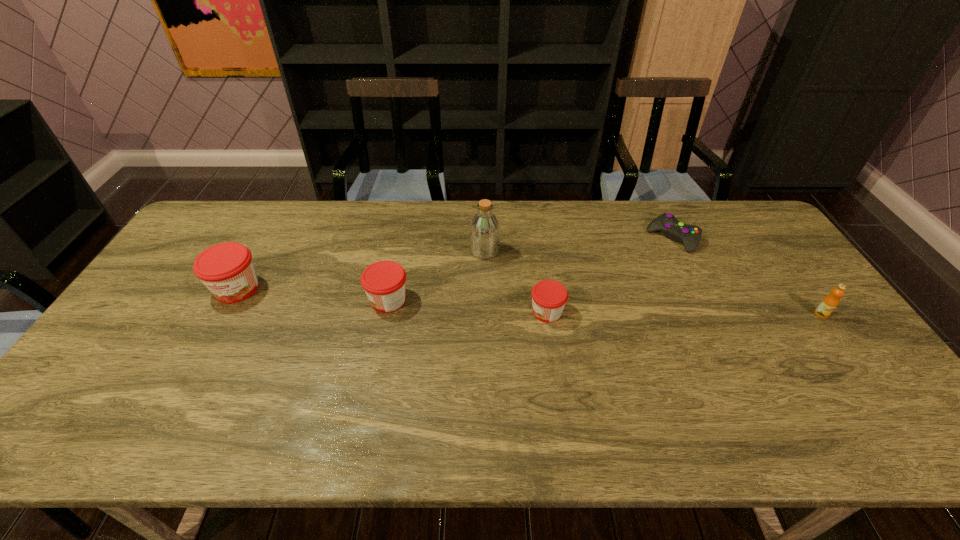
Identify the location of the leftmost jam. (227, 270).

The image size is (960, 540). In order to click on the tallest jam in this screenshot , I will do `click(227, 270)`.

Identify the location of the second jam from right to left. (384, 282).

Identify the location of the second tallest jam. This screenshot has height=540, width=960. (384, 282).

Identify the location of the third object from right to left. (549, 297).

Find the location of a particular element. the rightmost jam is located at coordinates (549, 297).

The width and height of the screenshot is (960, 540). Find the location of `the shortest object`. the shortest object is located at coordinates (690, 235).

Locate an element on the screen. This screenshot has height=540, width=960. control is located at coordinates (690, 235).

The width and height of the screenshot is (960, 540). Identify the location of bottle. [x=484, y=230].

Locate an element on the screen. This screenshot has height=540, width=960. the tallest object is located at coordinates click(484, 230).